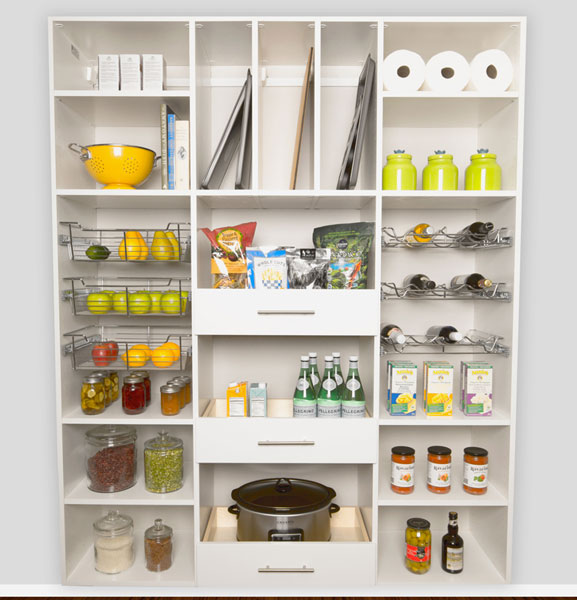
Identify the location of items for cooking, pots, pans etc. (227, 123), (243, 138), (349, 153), (355, 157), (297, 148), (126, 160), (263, 522).